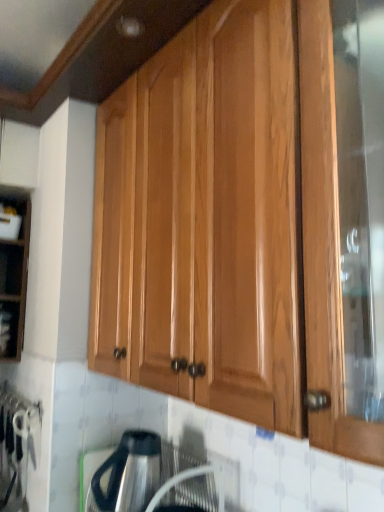
This screenshot has width=384, height=512. Identify the location of matte black shelf at left. (9, 329).

The width and height of the screenshot is (384, 512). Describe the element at coordinates (9, 329) in the screenshot. I see `matte black shelf at left` at that location.

This screenshot has height=512, width=384. What are the coordinates of `glossy wood cabinet at upper center` in the screenshot? It's located at (247, 221).

In order to click on shelf behind the glossy wood cabinet at upper center in this screenshot , I will do click(x=9, y=329).

From the image's perspective, is glossy wood cabinet at upper center above or below matte black shelf at left?

Clearly, from the image's perspective, glossy wood cabinet at upper center is above matte black shelf at left.

Is glossy wood cabinet at upper center in front of matte black shelf at left?

That is True.

Does glossy wood cabinet at upper center contain matte black shelf at left?

No, matte black shelf at left is not a part of glossy wood cabinet at upper center.

Considering the relative sizes of matte black shelf at left and glossy wood cabinet at upper center in the image provided, is matte black shelf at left smaller than glossy wood cabinet at upper center?

Yes.

From a real-world perspective, is matte black shelf at left located beneath glossy wood cabinet at upper center?

Yes.

Is matte black shelf at left in contact with glossy wood cabinet at upper center?

They are not placed beside each other.

Which object is wider, satin silver kettle at lower center or glossy wood cabinet at upper center?

glossy wood cabinet at upper center.

How different are the orientations of satin silver kettle at lower center and glossy wood cabinet at upper center in degrees?

satin silver kettle at lower center and glossy wood cabinet at upper center are facing 0.000237 degrees away from each other.

From the image's perspective, between satin silver kettle at lower center and glossy wood cabinet at upper center, who is located below?

From the image's view, satin silver kettle at lower center is below.

Considering the sizes of objects satin silver kettle at lower center and glossy wood cabinet at upper center in the image provided, who is taller, satin silver kettle at lower center or glossy wood cabinet at upper center?

Standing taller between the two is glossy wood cabinet at upper center.

Considering the points (196, 188) and (124, 454), which point is in front, point (196, 188) or point (124, 454)?

The point (196, 188) is more forward.

From the image's perspective, is glossy wood cabinet at upper center on satin silver kettle at lower center?

Correct, glossy wood cabinet at upper center appears higher than satin silver kettle at lower center in the image.

Which is in front, glossy wood cabinet at upper center or satin silver kettle at lower center?

glossy wood cabinet at upper center is in front.

Is glossy wood cabinet at upper center oriented away from satin silver kettle at lower center?

No, satin silver kettle at lower center is not at the back of glossy wood cabinet at upper center.

How many degrees apart are the facing directions of satin silver kettle at lower center and matte black shelf at left?

The angular difference between satin silver kettle at lower center and matte black shelf at left is 85.5 degrees.

Is satin silver kettle at lower center taller or shorter than matte black shelf at left?

Clearly, satin silver kettle at lower center is taller compared to matte black shelf at left.

From the picture: Is satin silver kettle at lower center not inside matte black shelf at left?

Yes, satin silver kettle at lower center is not within matte black shelf at left.

In the scene shown: From a real-world perspective, is satin silver kettle at lower center over matte black shelf at left?

Actually, satin silver kettle at lower center is physically below matte black shelf at left in the real world.

Is matte black shelf at left beside satin silver kettle at lower center?

No, matte black shelf at left is not in contact with satin silver kettle at lower center.

Looking at the image, does matte black shelf at left seem bigger or smaller compared to satin silver kettle at lower center?

Considering their sizes, matte black shelf at left takes up less space than satin silver kettle at lower center.

Is matte black shelf at left aimed at satin silver kettle at lower center?

No.

Between matte black shelf at left and satin silver kettle at lower center, which one appears on the right side from the viewer's perspective?

From the viewer's perspective, satin silver kettle at lower center appears more on the right side.

The width and height of the screenshot is (384, 512). Identify the location of cabinetry that appears above the matte black shelf at left (from the image's perspective). (247, 221).

Locate an element on the screen. cabinetry above the matte black shelf at left (from a real-world perspective) is located at coordinates (247, 221).

From the image, which object appears to be farther from matte black shelf at left, satin silver kettle at lower center or glossy wood cabinet at upper center?

glossy wood cabinet at upper center is further to matte black shelf at left.

Considering their positions, is matte black shelf at left positioned closer to satin silver kettle at lower center than glossy wood cabinet at upper center?

Among the two, glossy wood cabinet at upper center is located nearer to satin silver kettle at lower center.

When comparing their distances from glossy wood cabinet at upper center, does matte black shelf at left or satin silver kettle at lower center seem further?

The object further to glossy wood cabinet at upper center is matte black shelf at left.

From the image, which object appears to be nearer to satin silver kettle at lower center, glossy wood cabinet at upper center or matte black shelf at left?

glossy wood cabinet at upper center is positioned closer to the anchor satin silver kettle at lower center.

Based on their spatial positions, is satin silver kettle at lower center or matte black shelf at left closer to glossy wood cabinet at upper center?

satin silver kettle at lower center is closer to glossy wood cabinet at upper center.

When comparing their distances from matte black shelf at left, does glossy wood cabinet at upper center or satin silver kettle at lower center seem closer?

Among the two, satin silver kettle at lower center is located nearer to matte black shelf at left.

Where is `appliance positioned between glossy wood cabinet at upper center and matte black shelf at left from near to far`? The width and height of the screenshot is (384, 512). appliance positioned between glossy wood cabinet at upper center and matte black shelf at left from near to far is located at coordinates (150, 478).